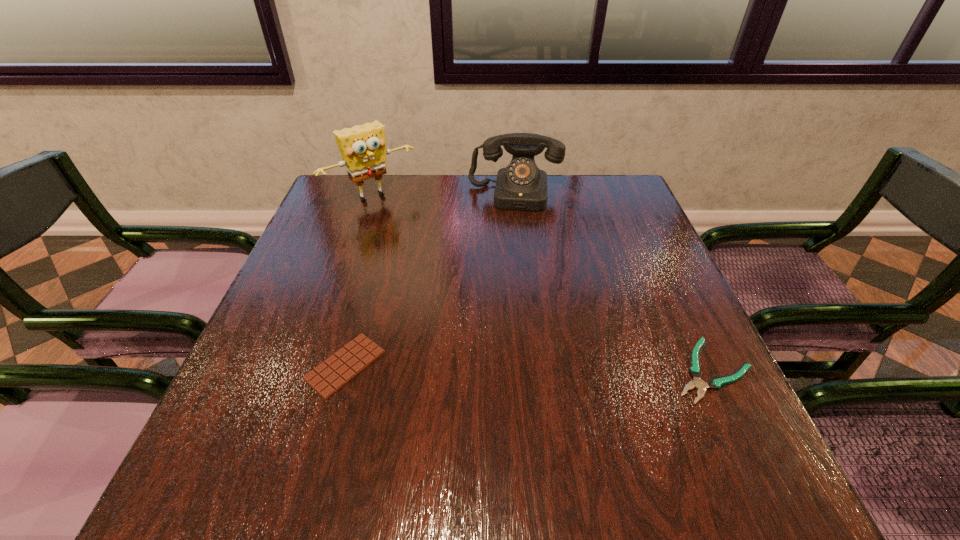
You are a GUI agent. You are given a task and a screenshot of the screen. Output one action in this format:
    pyautogui.click(x=<x>, y=<y>)
    Task: Click on the object situated at the far left corner
    The height and width of the screenshot is (540, 960).
    Given the screenshot: What is the action you would take?
    pyautogui.click(x=362, y=147)

The width and height of the screenshot is (960, 540). In order to click on object located at the near left corner in this screenshot , I will do `click(334, 373)`.

Locate an element on the screen. This screenshot has width=960, height=540. object present at the near right corner is located at coordinates (695, 371).

Find the location of a particular element. The height and width of the screenshot is (540, 960). free space at the far edge of the desktop is located at coordinates (578, 201).

What are the coordinates of `free space at the near edge of the desktop` in the screenshot? It's located at (351, 411).

In the image, there is a desktop. At what (x,y) coordinates should I click in order to perform the action: click on vacant space at the left edge. Please return your answer as a coordinate pair (x, y). This screenshot has width=960, height=540. Looking at the image, I should click on (339, 293).

This screenshot has height=540, width=960. In the image, there is a desktop. In order to click on vacant space at the right edge in this screenshot , I will do `click(636, 262)`.

Where is `vacant space at the far right corner`? The image size is (960, 540). vacant space at the far right corner is located at coordinates (579, 181).

I want to click on free space between the candy bar and the sponge, so click(359, 281).

Identify the location of vacant area that lies between the second tallest object and the rightmost object. (612, 282).